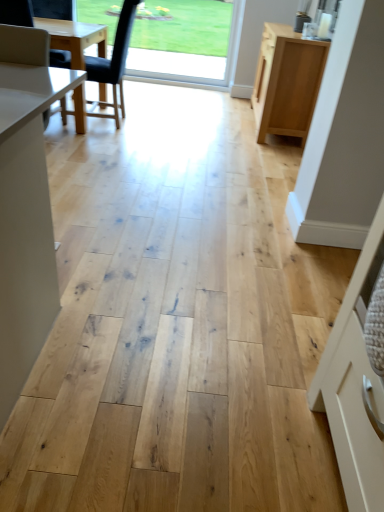
Question: Is transparent glass window at upper center not inside black leather chair at left?

Choices:
 (A) no
 (B) yes

Answer: (B)

Question: Is transparent glass window at upper center thinner than black leather chair at left?

Choices:
 (A) yes
 (B) no

Answer: (A)

Question: Does transparent glass window at upper center have a larger size compared to black leather chair at left?

Choices:
 (A) no
 (B) yes

Answer: (A)

Question: Is the position of transparent glass window at upper center more distant than that of black leather chair at left?

Choices:
 (A) no
 (B) yes

Answer: (B)

Question: Is transparent glass window at upper center wider than black leather chair at left?

Choices:
 (A) yes
 (B) no

Answer: (B)

Question: From a real-world perspective, is light wood cabinet at right physically located above or below black leather chair at left?

Choices:
 (A) below
 (B) above

Answer: (A)

Question: From the image's perspective, relative to black leather chair at left, is light wood cabinet at right above or below?

Choices:
 (A) above
 (B) below

Answer: (A)

Question: Is light wood cabinet at right taller or shorter than black leather chair at left?

Choices:
 (A) tall
 (B) short

Answer: (B)

Question: Based on their positions, is light wood cabinet at right located to the left or right of black leather chair at left?

Choices:
 (A) left
 (B) right

Answer: (B)

Question: Based on their sizes in the image, would you say black leather chair at left is bigger or smaller than light wood cabinet at right?

Choices:
 (A) big
 (B) small

Answer: (B)

Question: Would you say black leather chair at left is inside or outside light wood cabinet at right?

Choices:
 (A) inside
 (B) outside

Answer: (B)

Question: In terms of height, does black leather chair at left look taller or shorter compared to light wood cabinet at right?

Choices:
 (A) tall
 (B) short

Answer: (A)

Question: Considering the positions of point (112, 77) and point (296, 116), is point (112, 77) closer or farther from the camera than point (296, 116)?

Choices:
 (A) farther
 (B) closer

Answer: (B)

Question: Is black leather chair at left wider or thinner than transparent glass window at upper center?

Choices:
 (A) wide
 (B) thin

Answer: (A)

Question: From the image's perspective, relative to transparent glass window at upper center, is black leather chair at left above or below?

Choices:
 (A) below
 (B) above

Answer: (A)